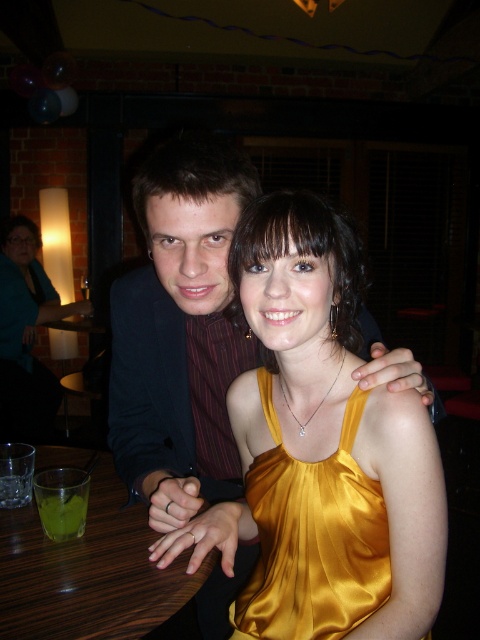
Can you confirm if brown wood table at lower left is positioned below matte teal blouse at left?

Correct, brown wood table at lower left is located below matte teal blouse at left.

Is brown wood table at lower left above matte teal blouse at left?

No.

Is point (6, 548) closer to camera compared to point (12, 291)?

Yes, it is in front of point (12, 291).

You are a GUI agent. You are given a task and a screenshot of the screen. Output one action in this format:
    pyautogui.click(x=<x>, y=<y>)
    Task: Click on the brown wood table at lower left
    The image size is (480, 640).
    Given the screenshot: What is the action you would take?
    pyautogui.click(x=88, y=572)

This screenshot has width=480, height=640. What do you see at coordinates (180, 332) in the screenshot?
I see `satin black suit at upper left` at bounding box center [180, 332].

Is satin black suit at upper left thinner than matte teal blouse at left?

In fact, satin black suit at upper left might be wider than matte teal blouse at left.

The width and height of the screenshot is (480, 640). In order to click on satin black suit at upper left in this screenshot , I will do `click(180, 332)`.

Can you confirm if gold satin dress at center is positioned to the right of brown wood table at lower left?

Correct, you'll find gold satin dress at center to the right of brown wood table at lower left.

Who is lower down, gold satin dress at center or brown wood table at lower left?

brown wood table at lower left is lower down.

Find the location of a particular element. The image size is (480, 640). gold satin dress at center is located at coordinates (312, 538).